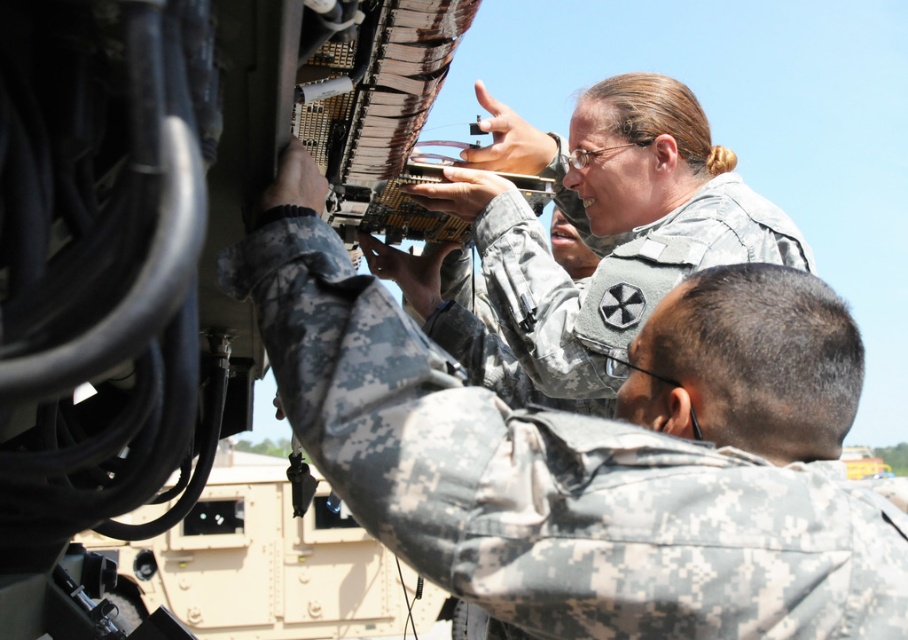
Can you confirm if camouflage uniform at center is wider than camouflage fabric uniform at upper center?

Incorrect, camouflage uniform at center's width does not surpass camouflage fabric uniform at upper center's.

Can you confirm if camouflage uniform at center is positioned above camouflage fabric uniform at upper center?

No.

Image resolution: width=908 pixels, height=640 pixels. What do you see at coordinates (577, 460) in the screenshot?
I see `camouflage uniform at center` at bounding box center [577, 460].

Where is `camouflage uniform at center`? camouflage uniform at center is located at coordinates (577, 460).